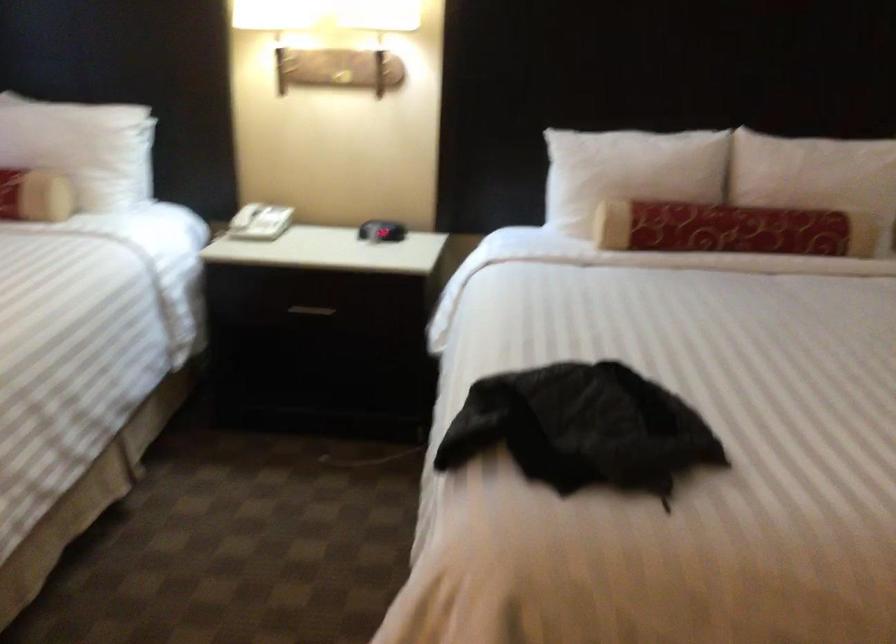
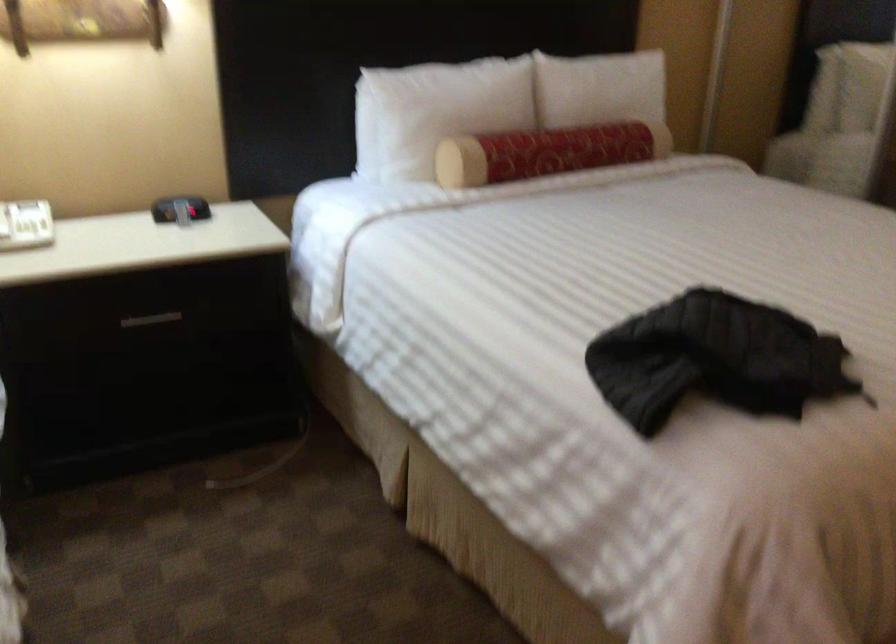
The point at (800,167) is marked in the first image. Where is the corresponding point in the second image?

(599, 88)